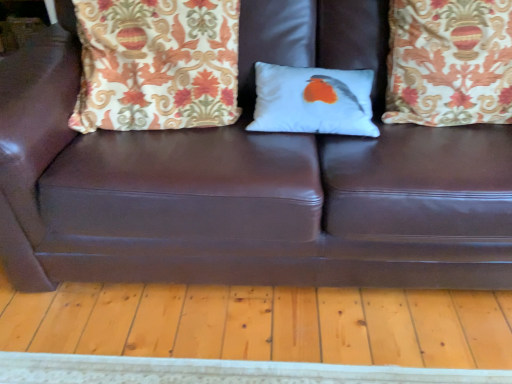
Locate an element on the screen. The width and height of the screenshot is (512, 384). white matte pillow with bird design at center, which is the second pillow from right to left is located at coordinates (313, 101).

Image resolution: width=512 pixels, height=384 pixels. I want to click on patterned fabric pillow at upper left, the third pillow positioned from the right, so click(x=157, y=64).

Considering the sizes of objects patterned fabric pillow at upper right, which appears as the third pillow when viewed from the left, and white matte pillow with bird design at center, which is the second pillow from right to left, in the image provided, who is smaller, patterned fabric pillow at upper right, which appears as the third pillow when viewed from the left, or white matte pillow with bird design at center, which is the second pillow from right to left,?

With smaller size is white matte pillow with bird design at center, which is the second pillow from right to left.

Does patterned fabric pillow at upper right, the first pillow when ordered from right to left, turn towards white matte pillow with bird design at center, which is the second pillow from right to left?

No, patterned fabric pillow at upper right, the first pillow when ordered from right to left, is not facing towards white matte pillow with bird design at center, which is the second pillow from right to left.

The height and width of the screenshot is (384, 512). Identify the location of pillow that appears on the right of white matte pillow with bird design at center, the 2th pillow positioned from the left. (449, 62).

Considering the sizes of objects patterned fabric pillow at upper right, the first pillow when ordered from right to left, and white matte pillow with bird design at center, which is the second pillow from right to left, in the image provided, who is wider, patterned fabric pillow at upper right, the first pillow when ordered from right to left, or white matte pillow with bird design at center, which is the second pillow from right to left,?

With larger width is patterned fabric pillow at upper right, the first pillow when ordered from right to left.

Considering the sizes of patterned fabric pillow at upper left, the third pillow positioned from the right, and patterned fabric pillow at upper right, the first pillow when ordered from right to left, in the image, is patterned fabric pillow at upper left, the third pillow positioned from the right, taller or shorter than patterned fabric pillow at upper right, the first pillow when ordered from right to left,?

In the image, patterned fabric pillow at upper left, the third pillow positioned from the right, appears to be shorter than patterned fabric pillow at upper right, the first pillow when ordered from right to left.

Considering the positions of objects patterned fabric pillow at upper left, the third pillow positioned from the right, and patterned fabric pillow at upper right, the first pillow when ordered from right to left, in the image provided, who is in front, patterned fabric pillow at upper left, the third pillow positioned from the right, or patterned fabric pillow at upper right, the first pillow when ordered from right to left,?

patterned fabric pillow at upper left, the third pillow positioned from the right.

Is point (204, 81) positioned before point (449, 77)?

Yes, it is in front of point (449, 77).

Starting from the patterned fabric pillow at upper left, placed as the 1th pillow when sorted from left to right, which pillow is the 1st one behind? Please provide its 2D coordinates.

[(449, 62)]

Does white matte pillow with bird design at center, the 2th pillow positioned from the left, have a greater width compared to patterned fabric pillow at upper right, which appears as the third pillow when viewed from the left?

No, white matte pillow with bird design at center, the 2th pillow positioned from the left, is not wider than patterned fabric pillow at upper right, which appears as the third pillow when viewed from the left.

Measure the distance from white matte pillow with bird design at center, the 2th pillow positioned from the left, to patterned fabric pillow at upper right, which appears as the third pillow when viewed from the left.

The distance of white matte pillow with bird design at center, the 2th pillow positioned from the left, from patterned fabric pillow at upper right, which appears as the third pillow when viewed from the left, is 10.40 inches.

Is there a large distance between white matte pillow with bird design at center, which is the second pillow from right to left, and patterned fabric pillow at upper right, which appears as the third pillow when viewed from the left?

No, white matte pillow with bird design at center, which is the second pillow from right to left, is not far away from patterned fabric pillow at upper right, which appears as the third pillow when viewed from the left.

At what (x,y) coordinates should I click in order to perform the action: click on pillow that appears on the right of white matte pillow with bird design at center, the 2th pillow positioned from the left. Please return your answer as a coordinate pair (x, y). Looking at the image, I should click on (449, 62).

In the scene shown: From a real-world perspective, between white matte pillow with bird design at center, the 2th pillow positioned from the left, and patterned fabric pillow at upper left, the third pillow positioned from the right, who is vertically higher?

patterned fabric pillow at upper left, the third pillow positioned from the right, from a real-world perspective.

Locate an element on the screen. The height and width of the screenshot is (384, 512). the 2nd pillow above the white matte pillow with bird design at center, the 2th pillow positioned from the left (from a real-world perspective) is located at coordinates (157, 64).

Between white matte pillow with bird design at center, which is the second pillow from right to left, and patterned fabric pillow at upper left, placed as the 1th pillow when sorted from left to right, which one is positioned in front?

patterned fabric pillow at upper left, placed as the 1th pillow when sorted from left to right, is more forward.

From a real-world perspective, is patterned fabric pillow at upper right, which appears as the third pillow when viewed from the left, below patterned fabric pillow at upper left, the third pillow positioned from the right?

Yes, from a real-world perspective, patterned fabric pillow at upper right, which appears as the third pillow when viewed from the left, is under patterned fabric pillow at upper left, the third pillow positioned from the right.

Would you consider patterned fabric pillow at upper right, which appears as the third pillow when viewed from the left, to be distant from patterned fabric pillow at upper left, the third pillow positioned from the right?

No, there isn't a large distance between patterned fabric pillow at upper right, which appears as the third pillow when viewed from the left, and patterned fabric pillow at upper left, the third pillow positioned from the right.

In the image, is patterned fabric pillow at upper right, which appears as the third pillow when viewed from the left, positioned in front of or behind patterned fabric pillow at upper left, placed as the 1th pillow when sorted from left to right?

Visually, patterned fabric pillow at upper right, which appears as the third pillow when viewed from the left, is located behind patterned fabric pillow at upper left, placed as the 1th pillow when sorted from left to right.

I want to click on pillow that is the 1st one when counting backward from the patterned fabric pillow at upper left, the third pillow positioned from the right, so click(x=449, y=62).

From a real-world perspective, is patterned fabric pillow at upper left, placed as the 1th pillow when sorted from left to right, beneath white matte pillow with bird design at center, which is the second pillow from right to left?

Actually, patterned fabric pillow at upper left, placed as the 1th pillow when sorted from left to right, is physically above white matte pillow with bird design at center, which is the second pillow from right to left, in the real world.

Is patterned fabric pillow at upper left, placed as the 1th pillow when sorted from left to right, inside the boundaries of white matte pillow with bird design at center, which is the second pillow from right to left, or outside?

patterned fabric pillow at upper left, placed as the 1th pillow when sorted from left to right, is located beyond the bounds of white matte pillow with bird design at center, which is the second pillow from right to left.

In the image, is patterned fabric pillow at upper left, the third pillow positioned from the right, positioned in front of or behind white matte pillow with bird design at center, which is the second pillow from right to left?

Visually, patterned fabric pillow at upper left, the third pillow positioned from the right, is located in front of white matte pillow with bird design at center, which is the second pillow from right to left.

Find the location of `pillow to the left of white matte pillow with bird design at center, the 2th pillow positioned from the left`. pillow to the left of white matte pillow with bird design at center, the 2th pillow positioned from the left is located at coordinates (157, 64).

The image size is (512, 384). Identify the location of the 1st pillow directly above the white matte pillow with bird design at center, the 2th pillow positioned from the left (from a real-world perspective). (449, 62).

This screenshot has height=384, width=512. I want to click on the 1st pillow behind the patterned fabric pillow at upper left, the third pillow positioned from the right, starting your count from the anchor, so click(x=449, y=62).

Based on their spatial positions, is white matte pillow with bird design at center, the 2th pillow positioned from the left, or patterned fabric pillow at upper left, the third pillow positioned from the right, closer to patterned fabric pillow at upper right, the first pillow when ordered from right to left?

Among the two, white matte pillow with bird design at center, the 2th pillow positioned from the left, is located nearer to patterned fabric pillow at upper right, the first pillow when ordered from right to left.

Considering their positions, is patterned fabric pillow at upper left, placed as the 1th pillow when sorted from left to right, positioned further to patterned fabric pillow at upper right, which appears as the third pillow when viewed from the left, than white matte pillow with bird design at center, the 2th pillow positioned from the left?

patterned fabric pillow at upper left, placed as the 1th pillow when sorted from left to right, is positioned further to the anchor patterned fabric pillow at upper right, which appears as the third pillow when viewed from the left.

Considering their positions, is patterned fabric pillow at upper left, placed as the 1th pillow when sorted from left to right, positioned further to white matte pillow with bird design at center, which is the second pillow from right to left, than patterned fabric pillow at upper right, which appears as the third pillow when viewed from the left?

Based on the image, patterned fabric pillow at upper left, placed as the 1th pillow when sorted from left to right, appears to be further to white matte pillow with bird design at center, which is the second pillow from right to left.

When comparing their distances from patterned fabric pillow at upper left, the third pillow positioned from the right, does patterned fabric pillow at upper right, the first pillow when ordered from right to left, or white matte pillow with bird design at center, the 2th pillow positioned from the left, seem closer?

white matte pillow with bird design at center, the 2th pillow positioned from the left, is closer to patterned fabric pillow at upper left, the third pillow positioned from the right.

Estimate the real-world distances between objects in this image. Which object is further from white matte pillow with bird design at center, the 2th pillow positioned from the left, patterned fabric pillow at upper right, the first pillow when ordered from right to left, or patterned fabric pillow at upper left, the third pillow positioned from the right?

patterned fabric pillow at upper left, the third pillow positioned from the right.

From the image, which object appears to be farther from patterned fabric pillow at upper left, the third pillow positioned from the right, white matte pillow with bird design at center, the 2th pillow positioned from the left, or patterned fabric pillow at upper right, the first pillow when ordered from right to left?

patterned fabric pillow at upper right, the first pillow when ordered from right to left, lies further to patterned fabric pillow at upper left, the third pillow positioned from the right, than the other object.

The image size is (512, 384). What are the coordinates of `pillow between patterned fabric pillow at upper left, placed as the 1th pillow when sorted from left to right, and patterned fabric pillow at upper right, the first pillow when ordered from right to left` in the screenshot? It's located at (313, 101).